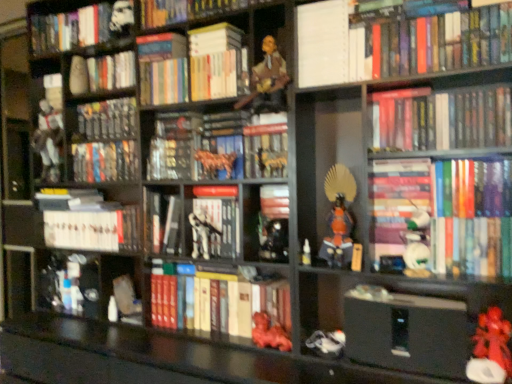
Question: Looking at their shapes, would you say hardcover book at center right, which is counted as the 6th book, starting from the bottom, is wider or thinner than rubberized red toy at lower right, which ranks as the eleventh toy in left-to-right order?

Choices:
 (A) thin
 (B) wide

Answer: (B)

Question: In the image, is hardcover book at center right, the tenth book positioned from the top, on the left side or the right side of rubberized red toy at lower right, the first toy in the right-to-left sequence?

Choices:
 (A) right
 (B) left

Answer: (B)

Question: Which of these objects is positioned closest to the metallic silver toy at center-left, which is the 9th book from bottom to top?

Choices:
 (A) white matte stormtrooper at upper left, positioned as the 10th toy in right-to-left order
 (B) white paper at upper center, the fourth book from the top
 (C) matte gray book at center, which is counted as the fifteenth book, starting from the top
 (D) hardcover book at center, which appears as the 14th book when viewed from the top
 (E) white matte skeleton at center, which is the ninth toy from right to left

Answer: (A)

Question: Which object is positioned closest to the rubberized red toy at lower right, the first toy in the right-to-left sequence?

Choices:
 (A) orange matte samurai armor at center, which is the third toy in right-to-left order
 (B) metallic gold figurine at center, the 4th toy in the left-to-right sequence
 (C) matte gray book at center, which is counted as the fifteenth book, starting from the top
 (D) white matte toy at center, the fourth toy viewed from the right
 (E) white matte stormtrooper at upper left, the second toy in the left-to-right sequence

Answer: (D)